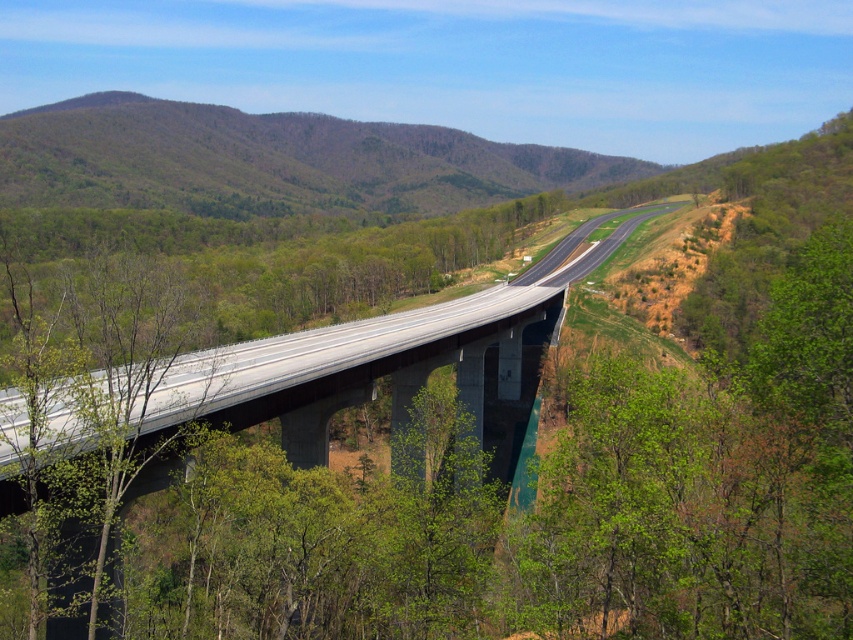
Question: Which object appears closest to the camera in this image?

Choices:
 (A) green leafy forest at upper center
 (B) green leafy tree at center

Answer: (B)

Question: Is the position of green leafy forest at upper center more distant than that of green leafy tree at center?

Choices:
 (A) no
 (B) yes

Answer: (B)

Question: Does green leafy forest at upper center come behind green leafy tree at center?

Choices:
 (A) yes
 (B) no

Answer: (A)

Question: Which point is closer to the camera?

Choices:
 (A) (22, 316)
 (B) (105, 132)

Answer: (A)

Question: Is the position of green leafy forest at upper center more distant than that of green leafy tree at center?

Choices:
 (A) yes
 (B) no

Answer: (A)